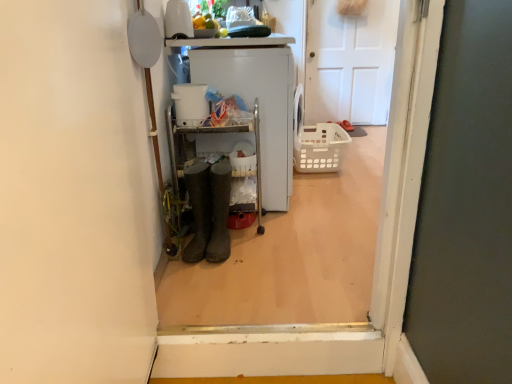
The image size is (512, 384). Find the location of `free space in front of brown leather boots at center, arranged as the first footwear when viewed from the left`. free space in front of brown leather boots at center, arranged as the first footwear when viewed from the left is located at coordinates (195, 280).